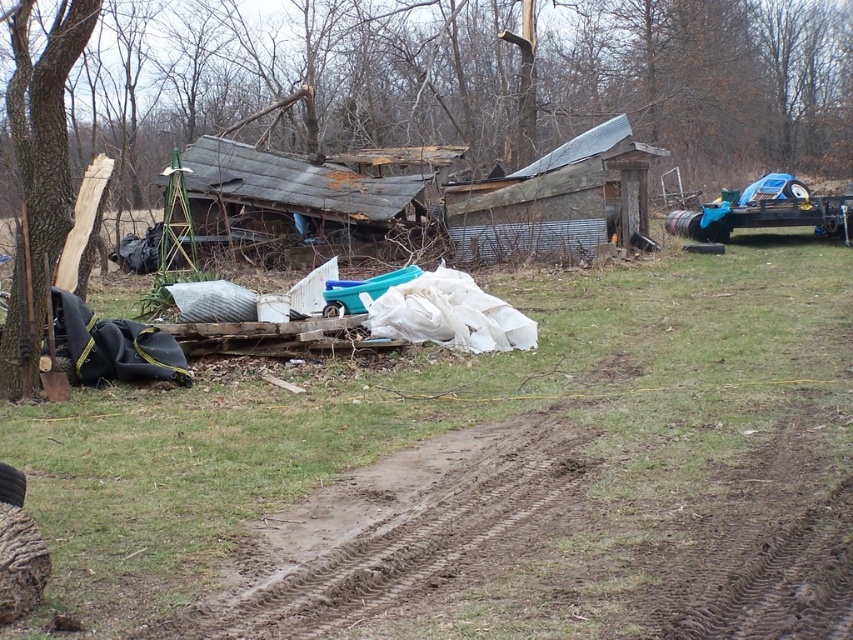
You are a hiker lost in the woods and see the brown wood tree at left and the rusty corrugated tin hut at center. Which object is higher in elevation?

The brown wood tree at left is above the rusty corrugated tin hut at center, so it is higher in elevation.

You are standing at the entrance of the rusty corrugated tin hut at center and want to find the brown wood tree at left. In which direction should you look?

You should look to the left because the brown wood tree at left is to the right of the rusty corrugated tin hut at center, meaning it is located on the left side from the hut.